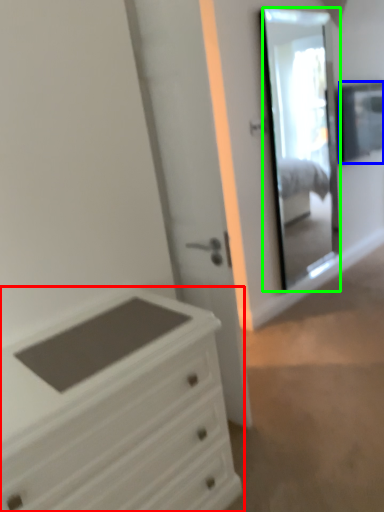
Question: Which object is the closest to the chest of drawers (highlighted by a red box)? Choose among these: window (highlighted by a blue box) or mirror (highlighted by a green box).

Choices:
 (A) window
 (B) mirror

Answer: (B)